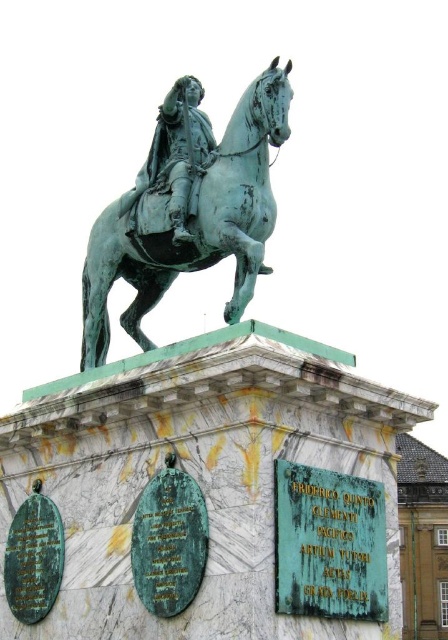
Can you confirm if green patina horse at center is wider than green patina statue at center?

Correct, the width of green patina horse at center exceeds that of green patina statue at center.

Find the location of `green patina horse at center`. green patina horse at center is located at coordinates (189, 209).

Locate an element on the screen. The image size is (448, 640). green patina horse at center is located at coordinates (189, 209).